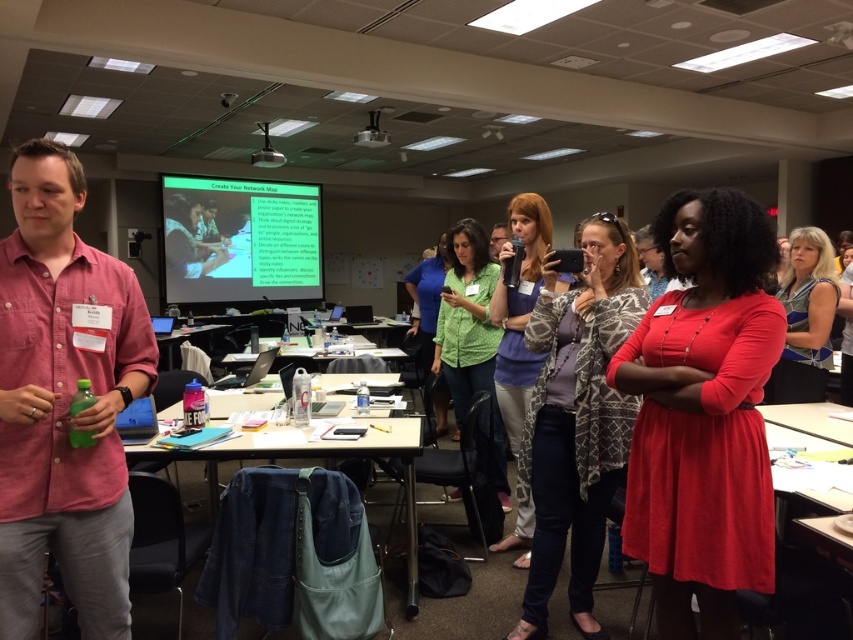
Question: Which point is farther to the camera?

Choices:
 (A) green matte shirt at center
 (B) green matte projector screen at center
 (C) green textured shirt at center
 (D) red matte dress at center

Answer: (B)

Question: Is the position of giraffe print scarf at center less distant than that of denim fabric at lower center?

Choices:
 (A) yes
 (B) no

Answer: (B)

Question: Considering the real-world distances, which object is closest to the giraffe print scarf at center?

Choices:
 (A) green matte shirt at center
 (B) wooden table at center

Answer: (A)

Question: In this image, where is green matte projector screen at center located relative to blue striped blouse at center?

Choices:
 (A) above
 (B) below

Answer: (A)

Question: Does green matte projector screen at center have a larger size compared to giraffe print scarf at center?

Choices:
 (A) yes
 (B) no

Answer: (A)

Question: Among these points, which one is nearest to the camera?

Choices:
 (A) coord(357,342)
 (B) coord(490,236)
 (C) coord(161,454)
 (D) coord(386,132)

Answer: (C)